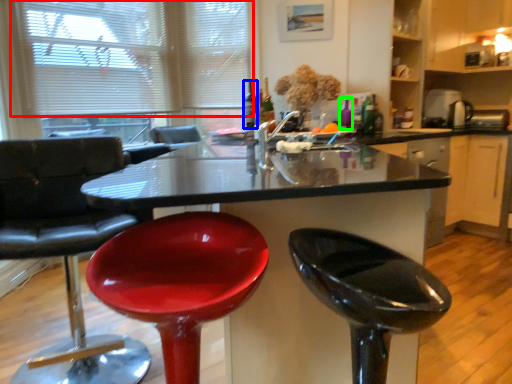
Question: Based on their relative distances, which object is nearer to blind (highlighted by a red box)? Choose from bottle (highlighted by a blue box) and bottle (highlighted by a green box).

Choices:
 (A) bottle
 (B) bottle

Answer: (A)